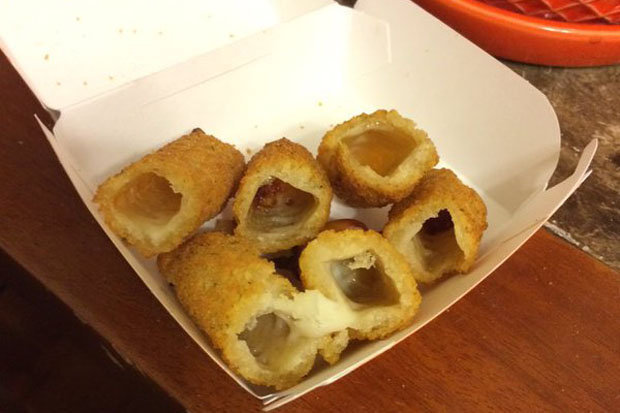
The width and height of the screenshot is (620, 413). Identify the location of plate. (533, 39).